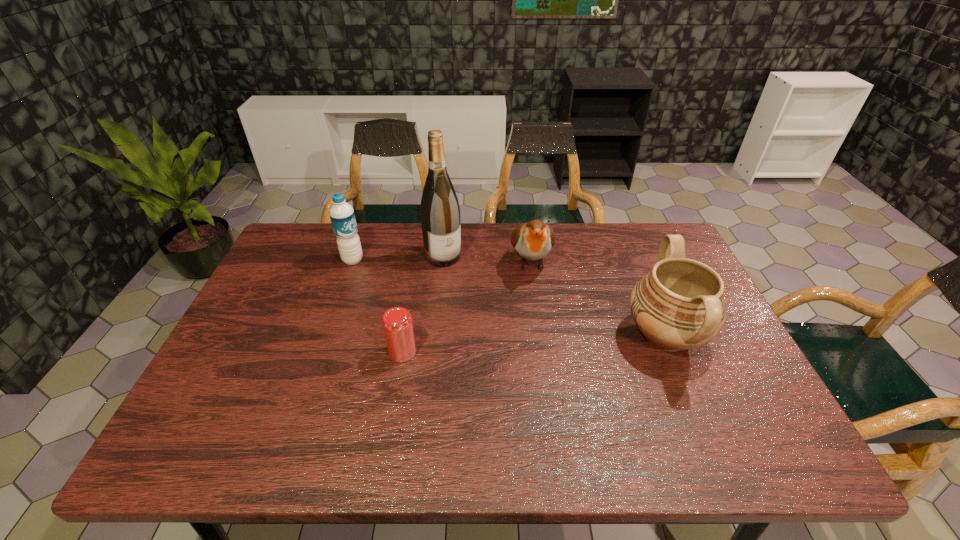
Where is `water bottle at the far edge`? This screenshot has height=540, width=960. water bottle at the far edge is located at coordinates (342, 216).

You are a GUI agent. You are given a task and a screenshot of the screen. Output one action in this format:
    pyautogui.click(x=<x>, y=<y>)
    Task: Click on the bird situated at the far edge
    The width and height of the screenshot is (960, 540).
    Given the screenshot: What is the action you would take?
    pyautogui.click(x=533, y=240)

The image size is (960, 540). Find the location of `object that is at the right edge`. object that is at the right edge is located at coordinates (679, 305).

Locate an element on the screen. vacant space at the far edge of the desktop is located at coordinates (383, 265).

Identify the location of free space at the left edge. This screenshot has height=540, width=960. (263, 283).

This screenshot has width=960, height=540. In the image, there is a desktop. Find the location of `vacant space at the far left corner`. vacant space at the far left corner is located at coordinates (318, 249).

The width and height of the screenshot is (960, 540). Find the location of `blank region between the urn and the second shortest object`. blank region between the urn and the second shortest object is located at coordinates (598, 299).

You are a GUI agent. You are given a task and a screenshot of the screen. Output one action in this format:
    pyautogui.click(x=<x>, y=<y>)
    Task: Click on the vacant area between the shortest object and the rightmost object
    Image resolution: width=960 pixels, height=540 pixels.
    Given the screenshot: What is the action you would take?
    point(534,344)

Locate an element on the screen. The image size is (960, 540). unoccupied area between the leftmost object and the beer can is located at coordinates (377, 306).

Identify the location of free space between the fourth object from left to right and the beer can. This screenshot has width=960, height=540. (467, 307).